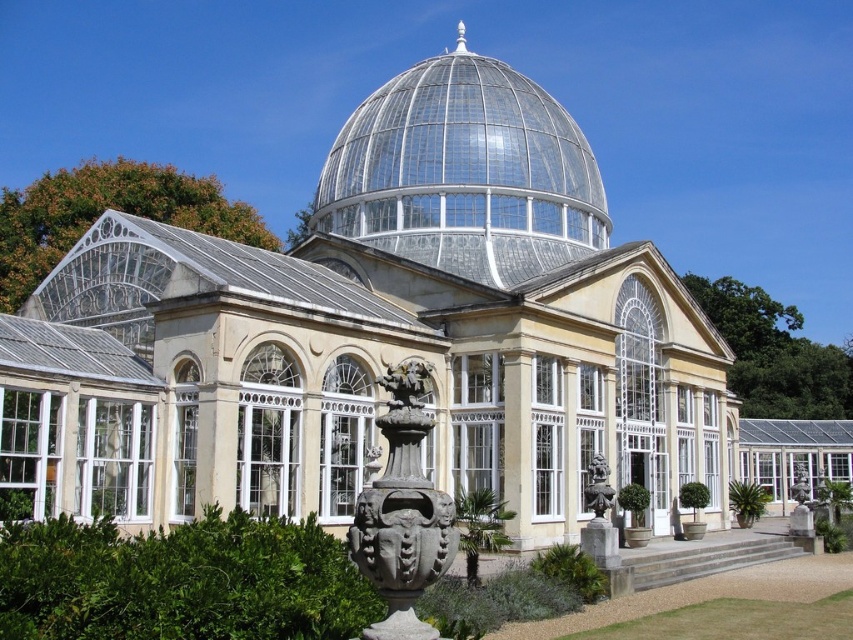
Question: Is gray stone sculpture at center bigger than matte stone statue at lower center?

Choices:
 (A) yes
 (B) no

Answer: (A)

Question: Observing the image, what is the correct spatial positioning of transparent glass dome at center in reference to matte stone statue at lower center?

Choices:
 (A) above
 (B) below

Answer: (A)

Question: Which point is closer to the camera taking this photo?

Choices:
 (A) (607, 504)
 (B) (434, 60)

Answer: (A)

Question: Does gray stone sculpture at center have a larger size compared to matte stone statue at lower center?

Choices:
 (A) no
 (B) yes

Answer: (B)

Question: Estimate the real-world distances between objects in this image. Which object is farther from the matte stone statue at lower center?

Choices:
 (A) transparent glass dome at center
 (B) gray stone sculpture at center

Answer: (A)

Question: Based on their relative distances, which object is farther from the matte stone statue at lower center?

Choices:
 (A) gray stone sculpture at center
 (B) transparent glass dome at center

Answer: (B)